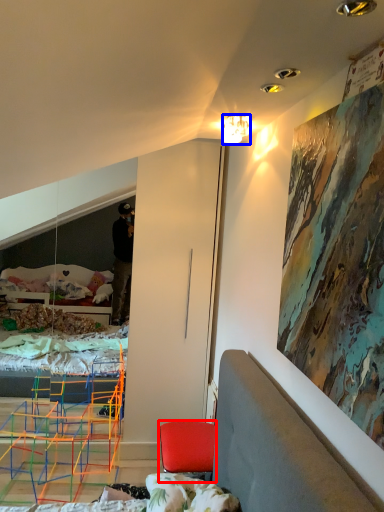
Question: Which object is closer to the camera taking this photo, chair (highlighted by a red box) or lamp (highlighted by a blue box)?

Choices:
 (A) chair
 (B) lamp

Answer: (B)